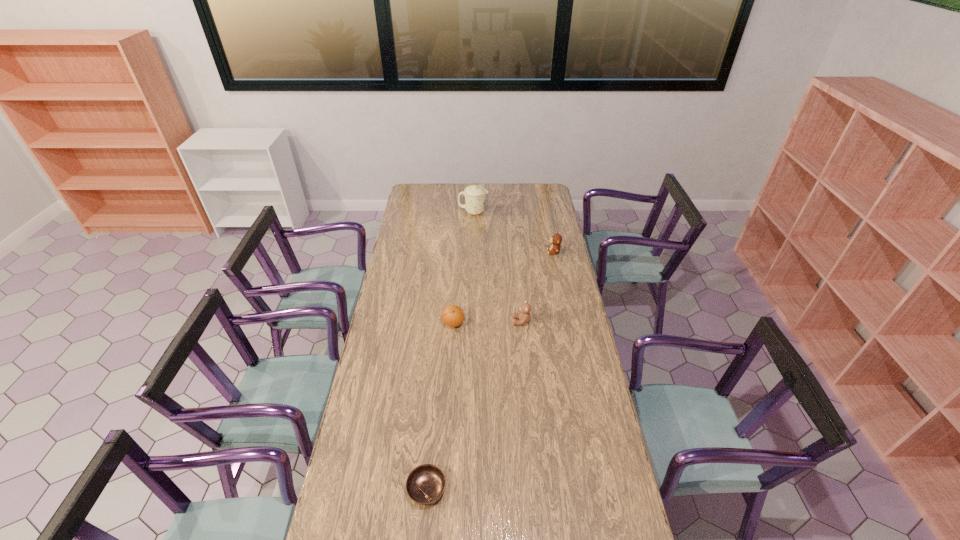
Locate an element on the screen. Image resolution: width=960 pixels, height=540 pixels. vacant region located 0.220m on the face of the right teddy bear is located at coordinates (506, 252).

Identify the location of blank area located 0.100m on the face of the right teddy bear. Image resolution: width=960 pixels, height=540 pixels. (528, 252).

Locate an element on the screen. This screenshot has width=960, height=540. free space located on the face of the right teddy bear is located at coordinates (484, 252).

You are a GUI agent. You are given a task and a screenshot of the screen. Output one action in this format:
    pyautogui.click(x=<x>, y=<y>)
    Task: Click on the free space located on the face of the second object from right to left
    Image resolution: width=960 pixels, height=540 pixels.
    Given the screenshot: What is the action you would take?
    coord(430,321)

The height and width of the screenshot is (540, 960). Identify the location of vacant space located on the face of the second object from right to left. (435, 321).

The width and height of the screenshot is (960, 540). Find the location of `vacant space located 0.140m on the face of the second object from right to left`. vacant space located 0.140m on the face of the second object from right to left is located at coordinates (481, 321).

You are a GUI agent. You are given a task and a screenshot of the screen. Output one action in this format:
    pyautogui.click(x=<x>, y=<y>)
    Task: Click on the vacant position located on the left of the orange
    The height and width of the screenshot is (540, 960).
    Given the screenshot: What is the action you would take?
    pyautogui.click(x=418, y=323)

What are the coordinates of `free location located on the back of the soup bowl` in the screenshot? It's located at (430, 453).

The width and height of the screenshot is (960, 540). I want to click on object located in the right edge section of the desktop, so click(x=556, y=240).

Identify the location of free space at the left edge of the desktop. (396, 413).